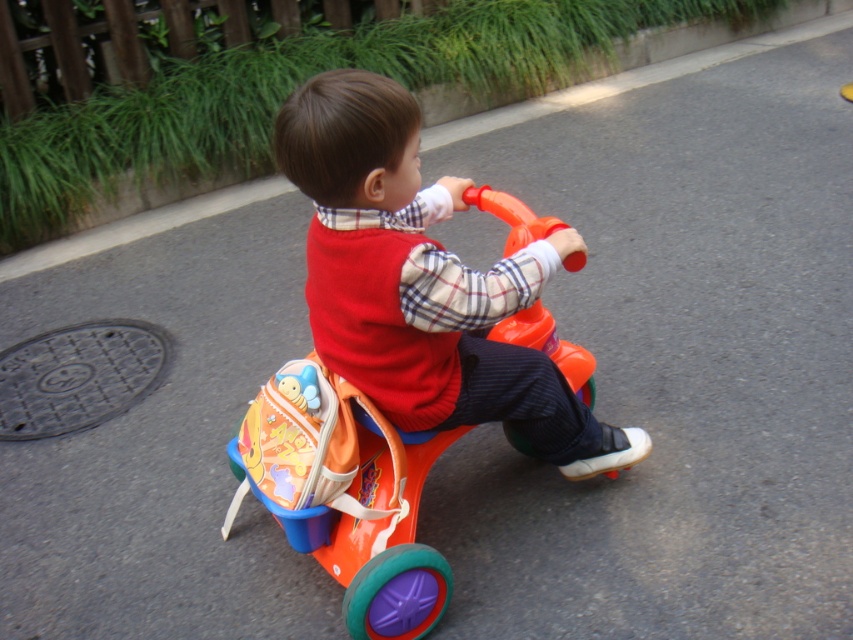
Question: Is matte orange plastic tricycle at center behind orange plastic tricycle at center?

Choices:
 (A) no
 (B) yes

Answer: (A)

Question: Which of the following is the closest to the observer?

Choices:
 (A) matte orange plastic tricycle at center
 (B) orange plastic tricycle at center

Answer: (A)

Question: Does matte orange plastic tricycle at center appear on the right side of orange plastic tricycle at center?

Choices:
 (A) no
 (B) yes

Answer: (B)

Question: Which object is closer to the camera taking this photo?

Choices:
 (A) orange plastic tricycle at center
 (B) matte orange plastic tricycle at center

Answer: (B)

Question: Does matte orange plastic tricycle at center appear over orange plastic tricycle at center?

Choices:
 (A) yes
 (B) no

Answer: (A)